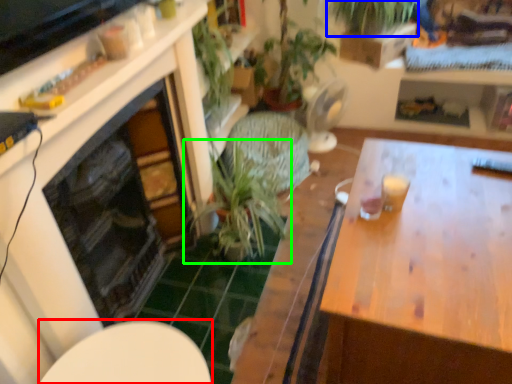
Question: Which is farther away from round table (highlighted by a red box)? vegetation (highlighted by a blue box) or houseplant (highlighted by a green box)?

Choices:
 (A) vegetation
 (B) houseplant

Answer: (A)